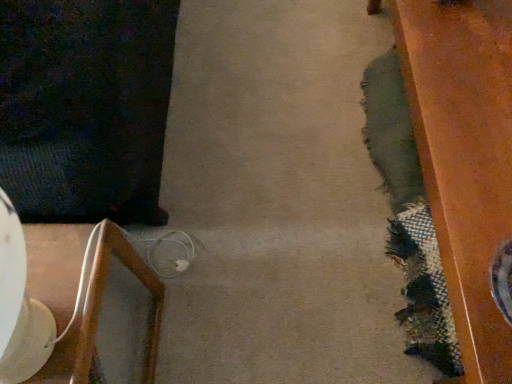
Question: Should I look upward or downward to see white glossy lampshade at left?

Choices:
 (A) up
 (B) down

Answer: (B)